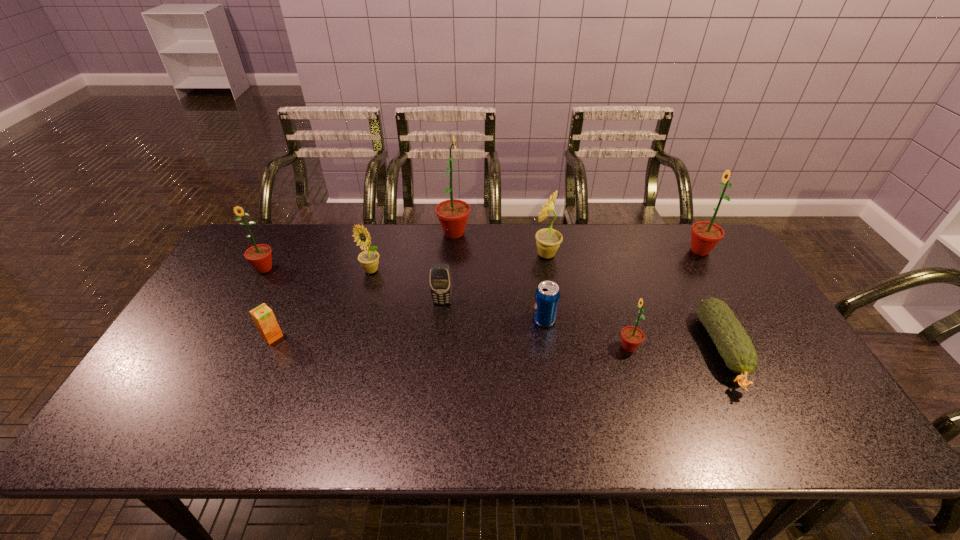
The width and height of the screenshot is (960, 540). In order to click on blank space located on the right of the pop soda in this screenshot , I will do `click(635, 320)`.

Find the location of `vacant region located 0.210m on the right of the orange juice`. vacant region located 0.210m on the right of the orange juice is located at coordinates (361, 336).

Locate an element on the screen. This screenshot has height=540, width=960. free space located at the blossom end of the shortest object is located at coordinates (759, 422).

Where is `object that is at the left edge`? object that is at the left edge is located at coordinates (259, 256).

At what (x,y) coordinates should I click in order to perform the action: click on sunflower present at the right edge. Please return your answer as a coordinate pair (x, y). Image resolution: width=960 pixels, height=540 pixels. Looking at the image, I should click on (705, 235).

You are a GUI agent. You are given a task and a screenshot of the screen. Output one action in this format:
    pyautogui.click(x=<x>, y=<y>)
    Task: Click on the cucumber present at the right edge
    
    Given the screenshot: What is the action you would take?
    pyautogui.click(x=735, y=347)

This screenshot has width=960, height=540. Identify the location of object located in the far left corner section of the desktop. (259, 256).

You are a GUI agent. You are given a task and a screenshot of the screen. Output one action in this format:
    pyautogui.click(x=<x>, y=<y>)
    Task: Click on the object that is positioned at the far right corner
    This screenshot has height=540, width=960.
    Given the screenshot: What is the action you would take?
    pyautogui.click(x=705, y=235)

You are a GUI agent. You are given a task and a screenshot of the screen. Output one action in this format:
    pyautogui.click(x=<x>, y=<y>)
    Task: Click on the free space at the far edge
    The height and width of the screenshot is (540, 960).
    Given the screenshot: What is the action you would take?
    pyautogui.click(x=347, y=239)

You are a GUI agent. You are given a task and a screenshot of the screen. Output one action in this format:
    pyautogui.click(x=<x>, y=<y>)
    Task: Click on the free region at the near edge of the desktop
    
    Given the screenshot: What is the action you would take?
    pyautogui.click(x=495, y=432)